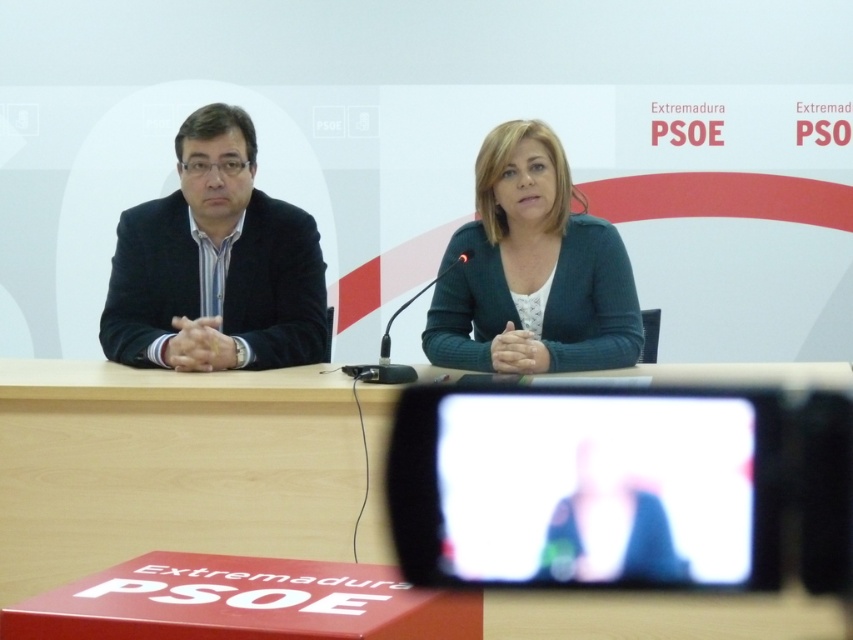
You are organizing a press conference and need to place a 12 inch laptop between the wooden table at center and the white glossy monitor at center. Can the laptop fit between them?

The wooden table at center is wider than the white glossy monitor at center, but the description does not provide specific measurements of the space between them. Therefore, it is unclear if the 12 inch laptop can fit between them.

You are setting up a camera to film the event. The camera requires a stand that must be placed on the wooden table at center or the white glossy monitor at center. The stand needs to be placed on the surface that is taller. Which object should you choose?

The wooden table at center is taller than the white glossy monitor at center, so you should place the stand on the wooden table at center.

You are organizing a small meeting and need to seat two people around the wooden table at center. Given that the matte black suit at left requires a minimum of 0.5 meters of space, can both attendees comfortably fit around the table?

The wooden table at center is bigger than the matte black suit at left, so yes, both attendees can comfortably fit around the wooden table at center as it provides sufficient space for their seating requirements.